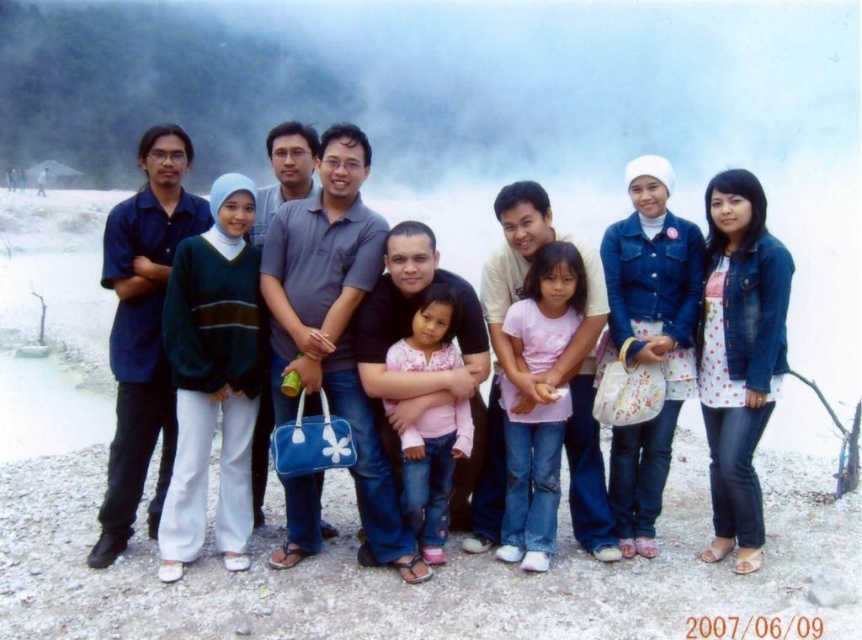
Between point (361, 452) and point (461, 362), which one is positioned in front?

Point (361, 452)

Measure the distance between point (297, 488) and camera.

Point (297, 488) and camera are 54.58 feet apart.

What are the coordinates of `matte black shirt at center` in the screenshot? It's located at (353, 324).

Is point (354, 246) farther from camera compared to point (504, 317)?

No, (354, 246) is closer to viewer.

Describe the element at coordinates (353, 324) in the screenshot. I see `matte black shirt at center` at that location.

Is point (509, 346) less distant than point (510, 326)?

No, it is not.

Locate an element on the screen. matte black shirt at center is located at coordinates point(353,324).

Is pink matte shirt at center shorter than pink fabric shirt at center?

Indeed, pink matte shirt at center has a lesser height compared to pink fabric shirt at center.

Looking at this image, can you confirm if pink matte shirt at center is taller than pink fabric shirt at center?

No.

Which is in front, point (504, 488) or point (440, 444)?

Point (440, 444)

Where is `pink matte shirt at center`? Image resolution: width=862 pixels, height=640 pixels. pink matte shirt at center is located at coordinates (531, 476).